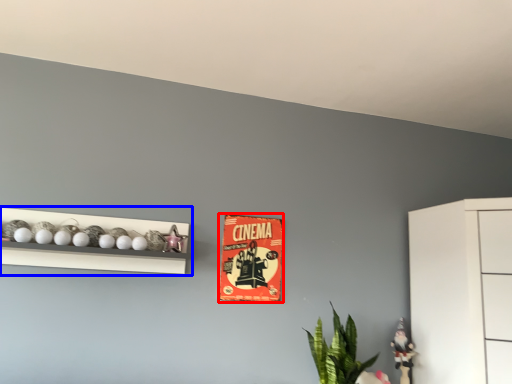
Question: Which object is closer to the camera taking this photo, postcard (highlighted by a red box) or shelf (highlighted by a blue box)?

Choices:
 (A) postcard
 (B) shelf

Answer: (B)